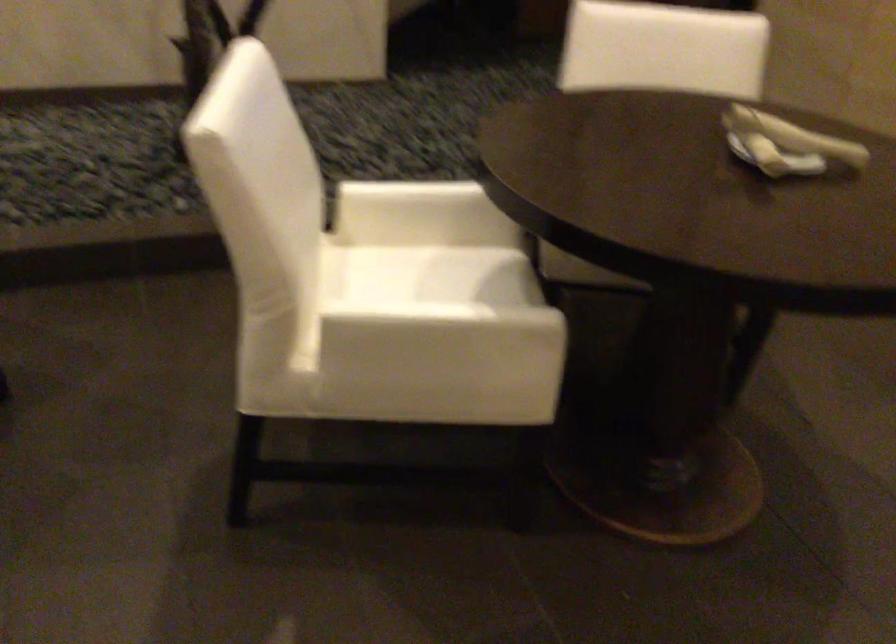
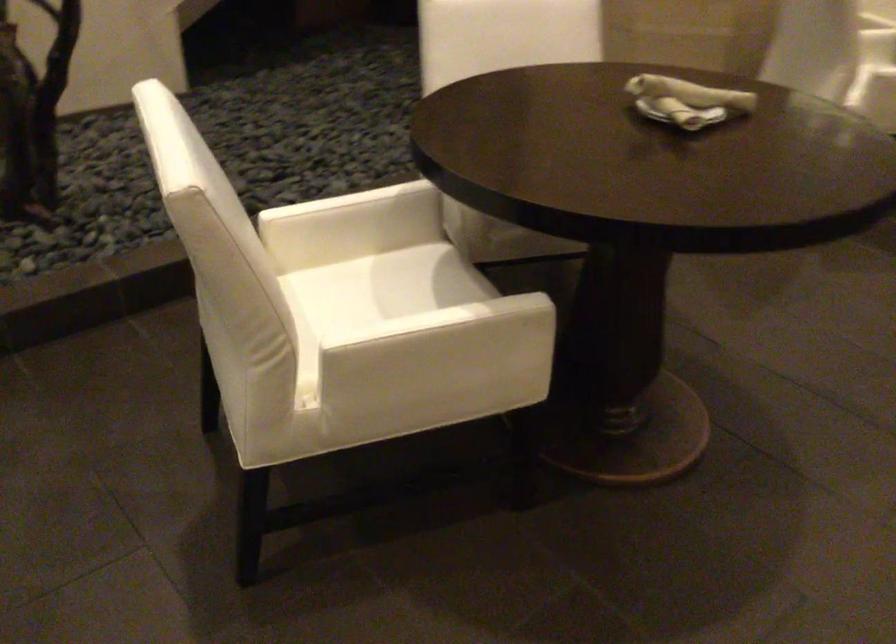
Question: What movement of the cameraman would produce the second image?

Choices:
 (A) Left
 (B) Right
 (C) Forward
 (D) Backward

Answer: (A)